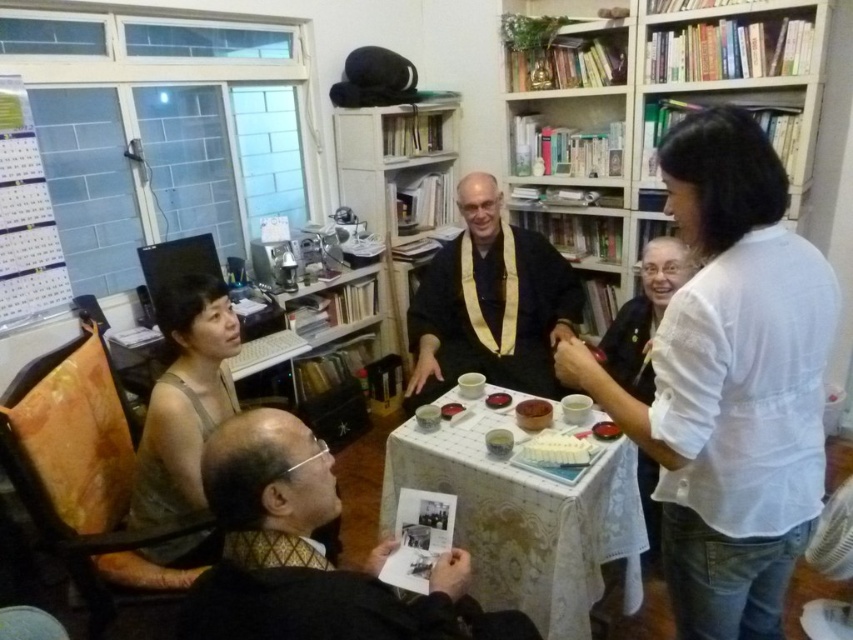
You are standing in the room and want to place a new plant pot between the white wooden bookshelf at upper right and the black textured jacket at lower left. Based on their positions, which side of the plant pot should face the bookshelf?

The white wooden bookshelf at upper right is positioned on the right side of the black textured jacket at lower left. Therefore, the right side of the plant pot should face the white wooden bookshelf at upper right, and the left side should face the black textured jacket at lower left.

From the picture: You are organizing a clothing display and need to arrange the white textured blouse at upper right and the white cotton blouse at upper right on a rack. Based on their sizes, which one should you place on the lower shelf to ensure proper visibility?

The white textured blouse at upper right has a lesser height compared to the white cotton blouse at upper right, so it should be placed on the lower shelf to ensure proper visibility.